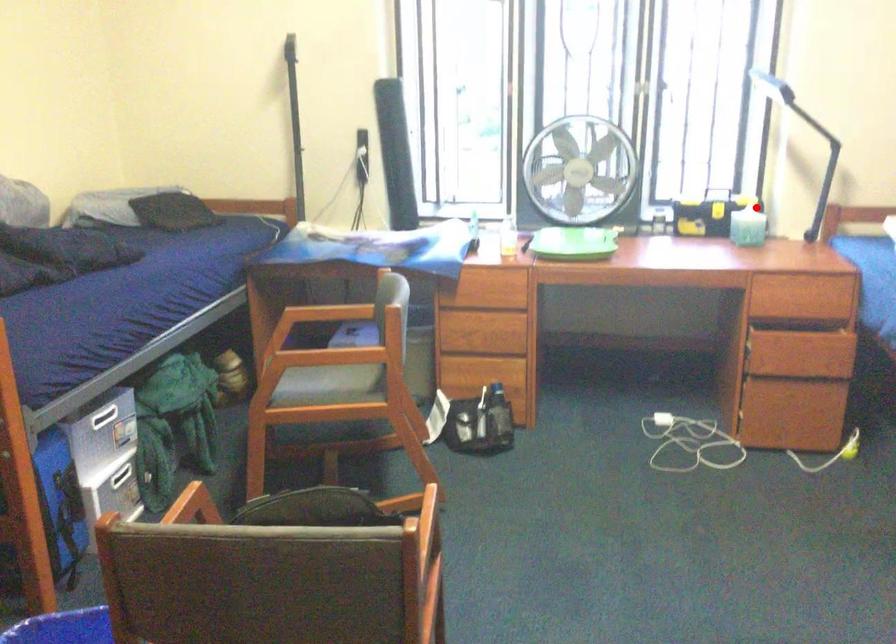
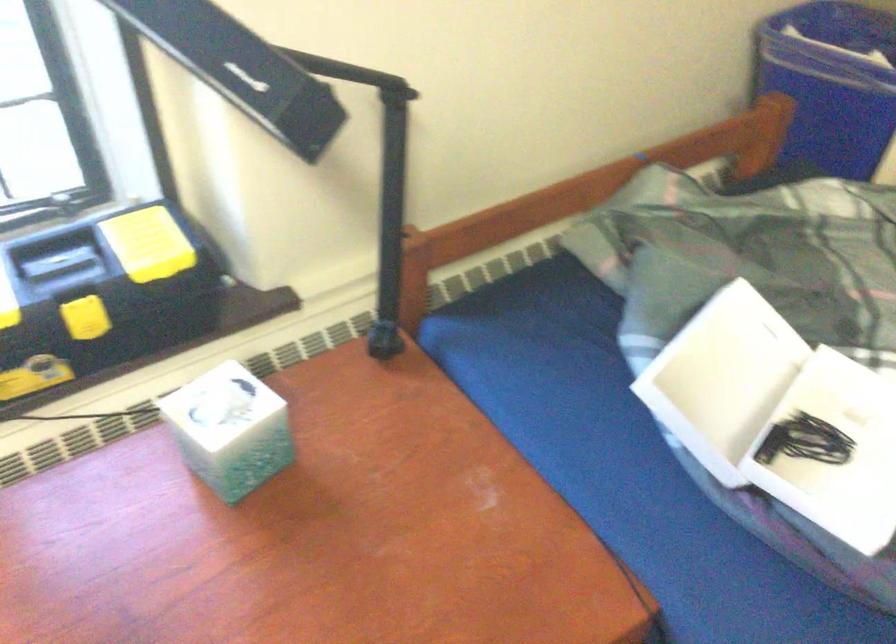
The point at the highlighted location is marked in the first image. Where is the corresponding point in the second image?

(229, 430)